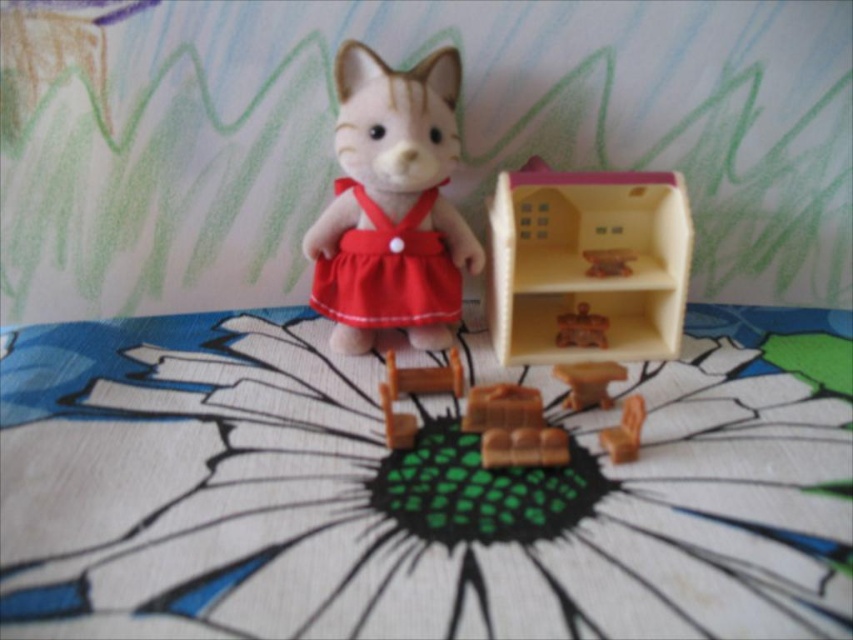
You are organizing a small party and need to place both the matte brown table at center and the matte brown furniture at center on a shelf. Which object should you place first to ensure they both fit?

The matte brown table at center might be wider than the matte brown furniture at center, so you should place the wider one first to ensure both fit on the shelf.

You are standing at the camera position and want to place a 12 inch wide gift box between the wooden chair at lower center and the camera. Is there enough space?

The wooden chair at lower center and camera are 39.04 inches apart. Since the gift box is 12 inches wide, there is sufficient space between them to place the gift box.

You are trying to place a small vase on the table between the wooden toy at center and the wooden chair at lower center. Which object should you place the vase closer to so that it doesn

The wooden toy at center is taller than the wooden chair at lower center, so placing the vase closer to the wooden toy at center would ensure stability due to its height.